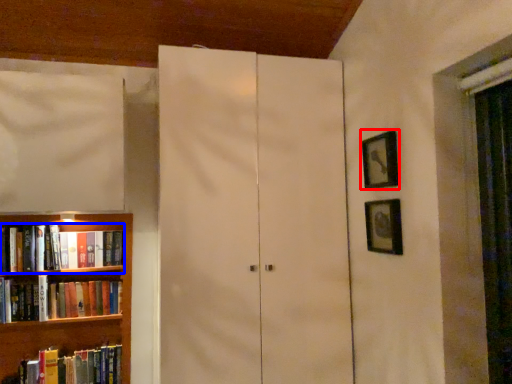
Question: Which object is closer to the camera taking this photo, picture frame (highlighted by a red box) or book (highlighted by a blue box)?

Choices:
 (A) picture frame
 (B) book

Answer: (A)